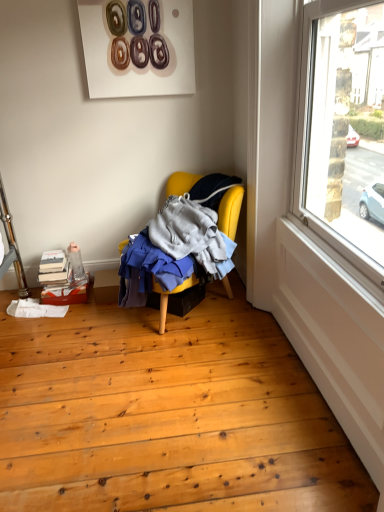
What do you see at coordinates (230, 211) in the screenshot? I see `yellow fabric chair at center` at bounding box center [230, 211].

What are the coordinates of `yellow fabric chair at center` in the screenshot? It's located at (230, 211).

Measure the distance between point (162, 310) and camera.

Point (162, 310) is 2.21 meters away from camera.

The image size is (384, 512). Find the location of `yellow fabric chair at center`. yellow fabric chair at center is located at coordinates (230, 211).